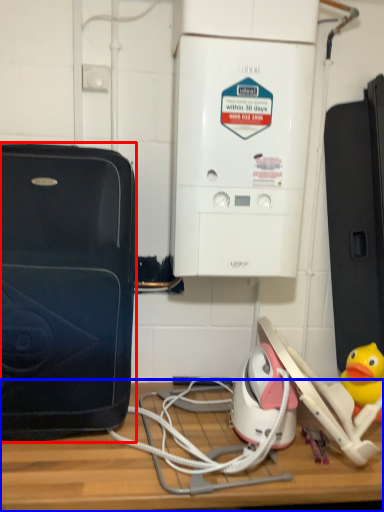
Question: Which of the following is the farthest to the observer, home appliance (highlighted by a red box) or table (highlighted by a blue box)?

Choices:
 (A) home appliance
 (B) table

Answer: (A)